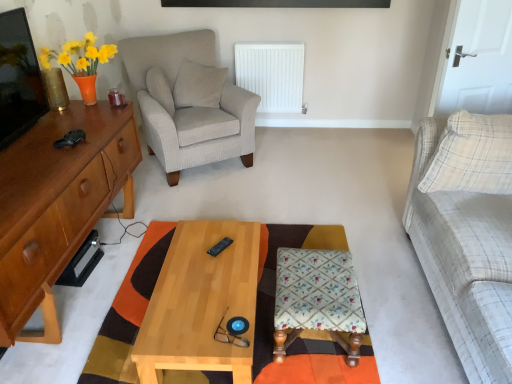
The width and height of the screenshot is (512, 384). Find the location of `vacant area on the back side of plaid fabric couch at right`. vacant area on the back side of plaid fabric couch at right is located at coordinates (354, 196).